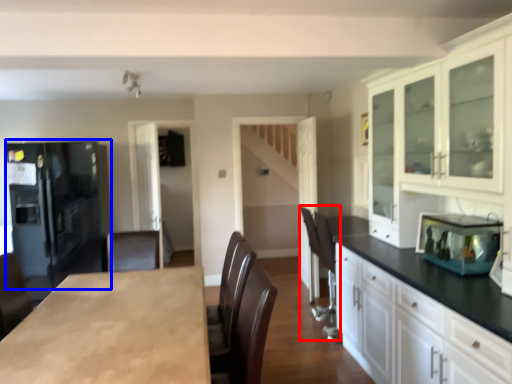
Question: Which of the following is the farthest to the observer, armchair (highlighted by a red box) or refrigerator (highlighted by a blue box)?

Choices:
 (A) armchair
 (B) refrigerator

Answer: (B)